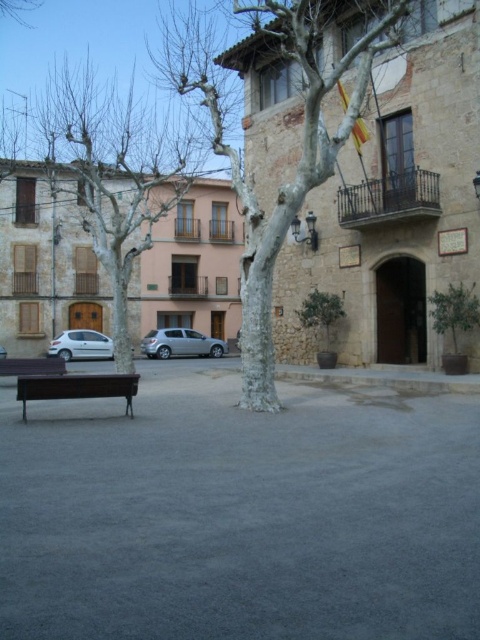
Question: Can you confirm if wooden park bench at lower left is thinner than dark brown wooden bench at lower left?

Choices:
 (A) yes
 (B) no

Answer: (A)

Question: Among these points, which one is farthest from the camera?

Choices:
 (A) (97, 339)
 (B) (2, 353)

Answer: (A)

Question: Does silver metallic hatchback at center come in front of silver metallic car at lower left?

Choices:
 (A) yes
 (B) no

Answer: (B)

Question: Does bare wood tree at left have a greater width compared to silver metallic car at lower left?

Choices:
 (A) yes
 (B) no

Answer: (A)

Question: Which point is farther to the camera?

Choices:
 (A) (168, 154)
 (B) (180, 326)
 (C) (86, 356)

Answer: (A)

Question: Which of the following is the closest to the observer?

Choices:
 (A) pyautogui.click(x=93, y=349)
 (B) pyautogui.click(x=60, y=368)

Answer: (B)